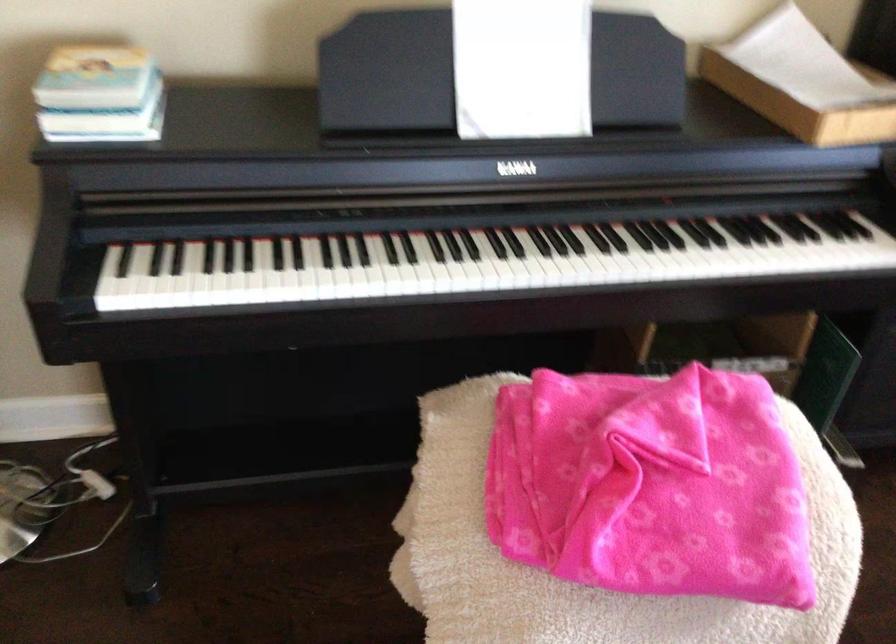
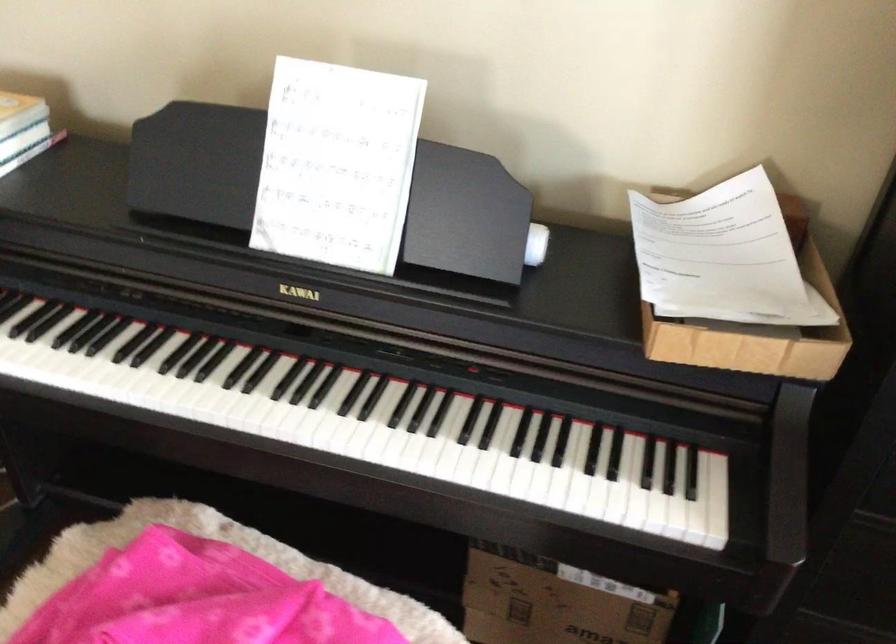
In the second image, find the point that corresponds to point (710, 227) in the first image.

(489, 424)